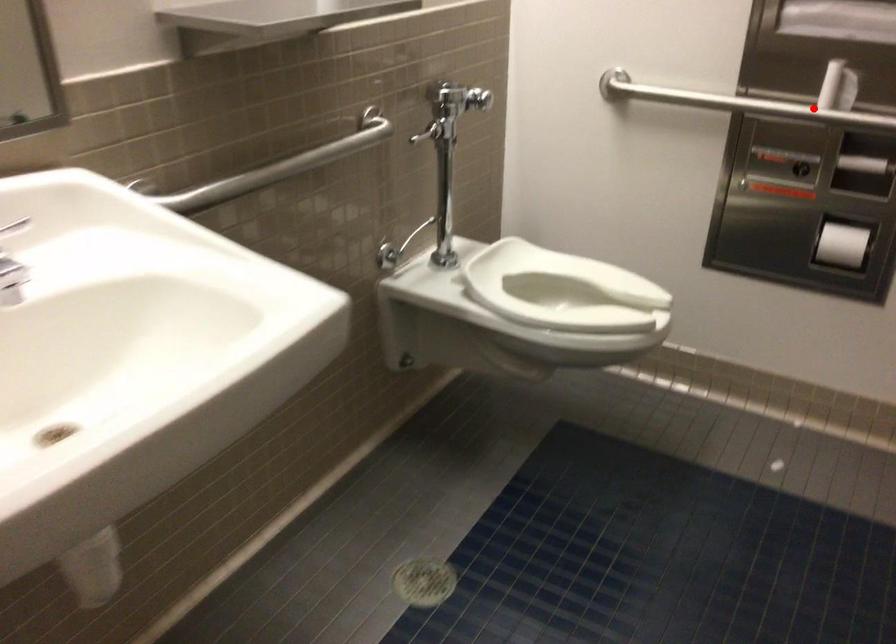
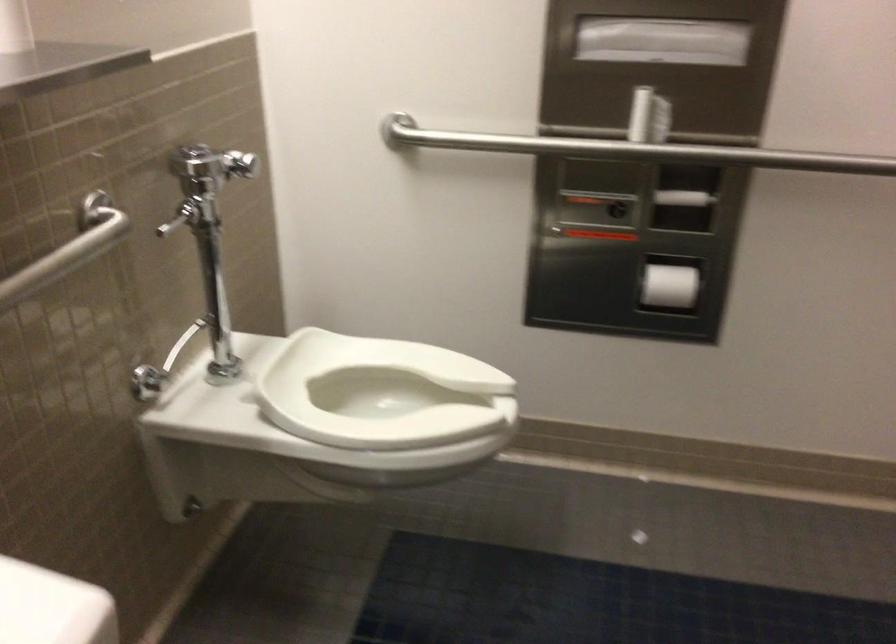
Question: I am providing you with two images of the same scene from different viewpoints. Given a red point in image1, look at the same physical point in image2. Is it:

Choices:
 (A) Closer to the viewpoint
 (B) Farther from the viewpoint

Answer: (A)